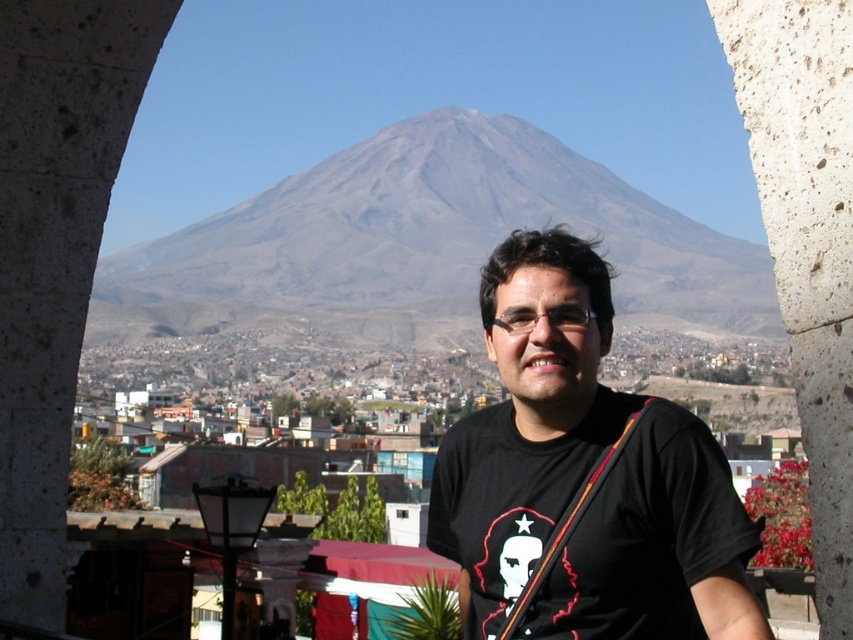
Question: Is gray stone pillar at right thinner than orange fabric strap at center?

Choices:
 (A) yes
 (B) no

Answer: (B)

Question: Which of the following is the farthest from the observer?

Choices:
 (A) (645, 557)
 (B) (587, 499)

Answer: (B)

Question: Can you confirm if gray stone pillar at right is smaller than orange fabric strap at center?

Choices:
 (A) no
 (B) yes

Answer: (A)

Question: Which object appears closest to the camera in this image?

Choices:
 (A) black matte shirt at center
 (B) gray/desert-textured mountain at center

Answer: (A)

Question: Does gray/desert-textured mountain at center have a greater width compared to black matte shirt at center?

Choices:
 (A) yes
 (B) no

Answer: (A)

Question: Which point is closer to the camera?

Choices:
 (A) gray stone pillar at right
 (B) gray/desert-textured mountain at center
 (C) black matte shirt at center
 (D) orange fabric strap at center

Answer: (A)